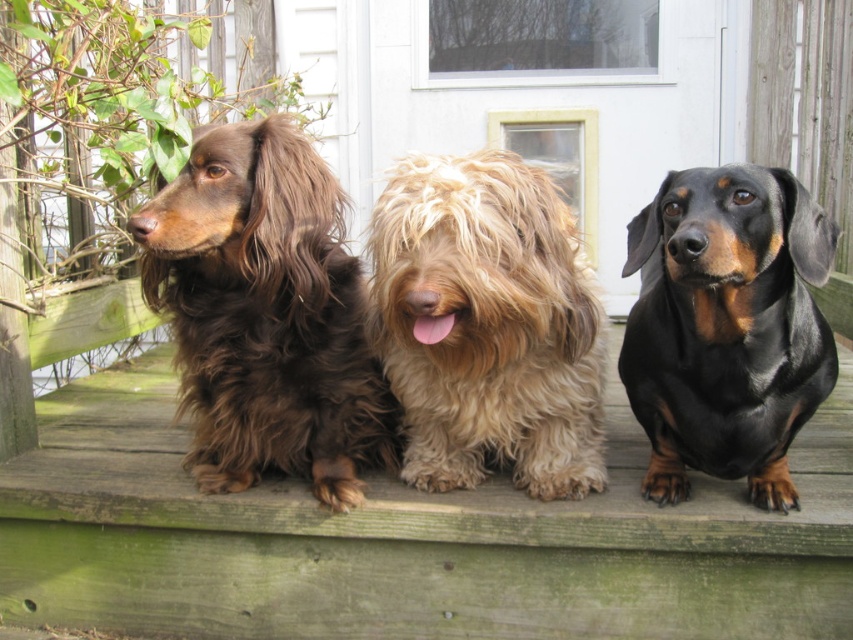
Who is more distant from viewer, (368, 381) or (445, 305)?

Point (368, 381)

Does shiny brown fur at center lie in front of fuzzy brown dog at center?

No, shiny brown fur at center is behind fuzzy brown dog at center.

Does point (244, 234) come behind point (604, 337)?

No, it is in front of (604, 337).

This screenshot has height=640, width=853. In order to click on shiny brown fur at center in this screenshot , I will do `click(265, 314)`.

Does shiny brown fur at center appear under black shiny dog at center?

Correct, shiny brown fur at center is located below black shiny dog at center.

Between point (252, 328) and point (685, 420), which one is positioned behind?

The point (252, 328) is more distant.

Image resolution: width=853 pixels, height=640 pixels. In order to click on shiny brown fur at center in this screenshot , I will do `click(265, 314)`.

The width and height of the screenshot is (853, 640). I want to click on fuzzy brown dog at center, so click(x=486, y=324).

Does fuzzy brown dog at center appear over black shiny dog at center?

Incorrect, fuzzy brown dog at center is not positioned above black shiny dog at center.

Measure the distance between fuzzy brown dog at center and camera.

fuzzy brown dog at center and camera are 5.28 feet apart.

Image resolution: width=853 pixels, height=640 pixels. Find the location of `fuzzy brown dog at center`. fuzzy brown dog at center is located at coordinates (486, 324).